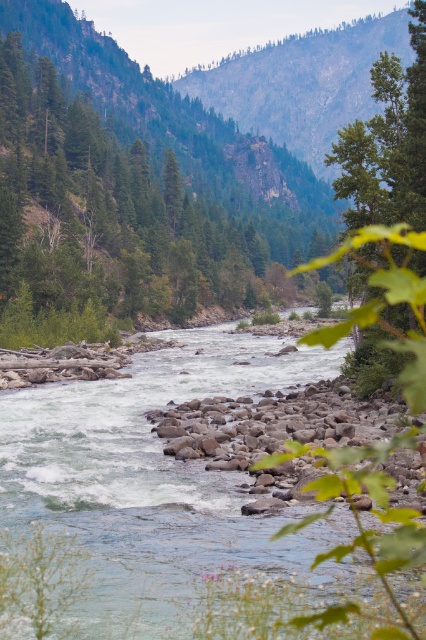
Can you confirm if white smooth water at center is bigger than green leafy tree at center?

No.

Is point (180, 573) positioned behind point (218, 234)?

No, it is in front of (218, 234).

Which is behind, point (308, 364) or point (271, 157)?

Point (271, 157)

You are a GUI agent. You are given a task and a screenshot of the screen. Output one action in this format:
    pyautogui.click(x=<x>, y=<y>)
    Task: Click on the white smooth water at center
    This screenshot has width=426, height=640.
    Given the screenshot: What is the action you would take?
    pyautogui.click(x=154, y=477)